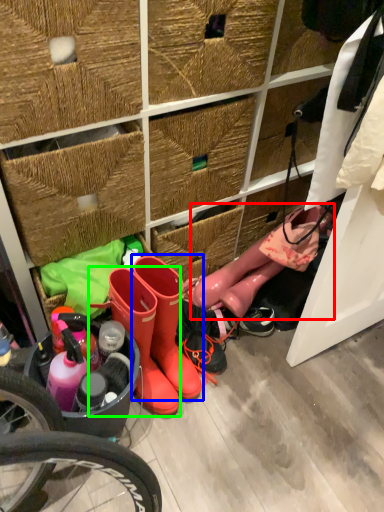
Question: Which is nearer to the footwear (highlighted by a red box)? footwear (highlighted by a blue box) or footwear (highlighted by a green box).

Choices:
 (A) footwear
 (B) footwear

Answer: (A)